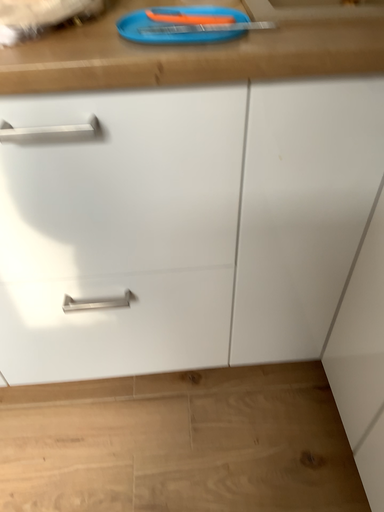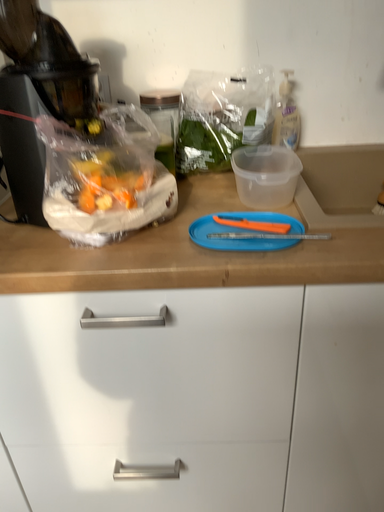
Question: Which way did the camera rotate in the video?

Choices:
 (A) rotated downward
 (B) rotated upward

Answer: (B)